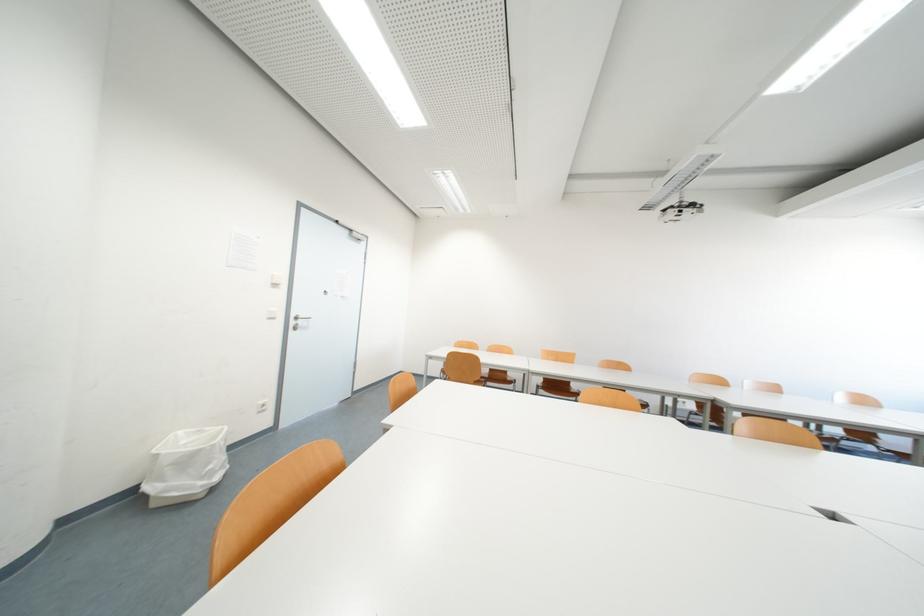
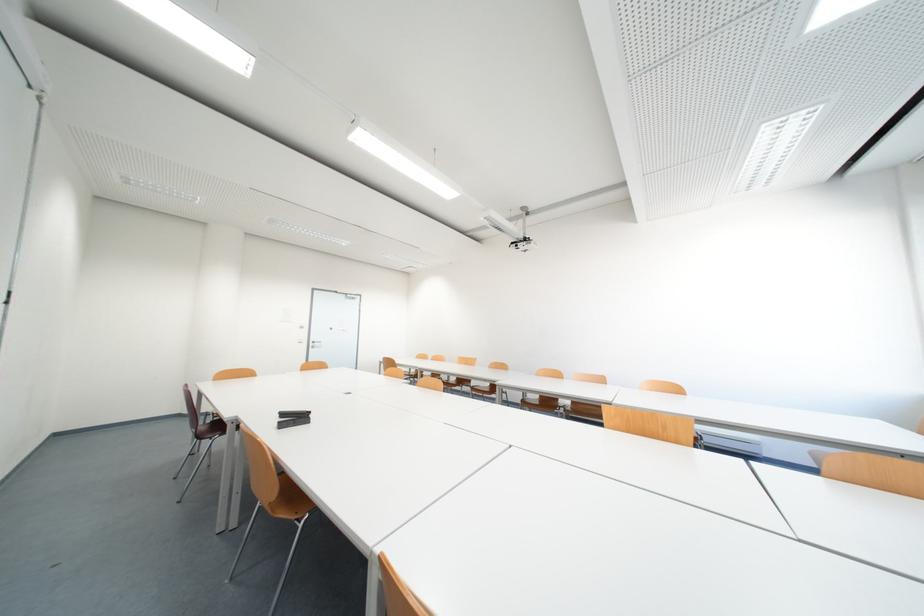
Question: The images are taken continuously from a first-person perspective. In which direction are you moving?

Choices:
 (A) Left
 (B) Right
 (C) Forward
 (D) Backward

Answer: (B)